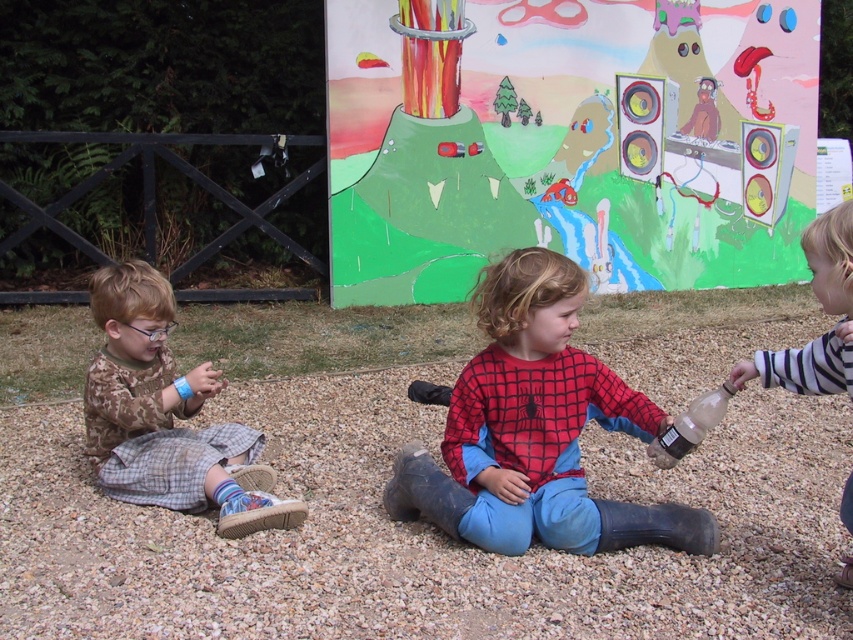
Is point (824, 538) behind point (566, 323)?

Yes, point (824, 538) is behind point (566, 323).

At what (x,y) coordinates should I click in order to perform the action: click on gray gravel at center. Please return your answer as a coordinate pair (x, y). Looking at the image, I should click on (422, 531).

Where is `striped cotton shirt at right`? The height and width of the screenshot is (640, 853). striped cotton shirt at right is located at coordinates (822, 310).

Which of these two, striped cotton shirt at right or clear plastic bottle at center, stands shorter?

clear plastic bottle at center

Where is `striped cotton shirt at right`? This screenshot has height=640, width=853. striped cotton shirt at right is located at coordinates (822, 310).

Is red plaid shirt at center to the right of clear plastic bottle at center from the viewer's perspective?

Incorrect, red plaid shirt at center is not on the right side of clear plastic bottle at center.

Can you confirm if red plaid shirt at center is shorter than clear plastic bottle at center?

No.

Is point (543, 541) in front of point (663, 452)?

That is False.

In order to click on red plaid shirt at center in this screenshot , I will do `click(535, 429)`.